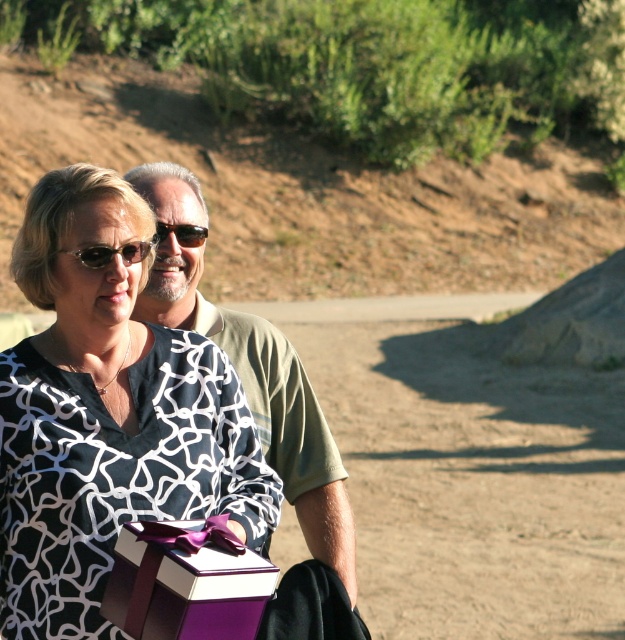
You are a photographer trying to capture a closeup of the green matte shirt at center and the brown matte sunglasses at center. Which object should you zoom in on more to ensure both fit in the frame?

Since the green matte shirt at center is bigger than the brown matte sunglasses at center, you should zoom in more on the brown matte sunglasses at center to ensure both fit in the frame.

You are a photographer trying to capture a clear shot of the green matte shirt at center and the brown matte sunglasses at center. Which object should you focus on first to ensure both are in focus?

The green matte shirt at center is closer to the viewer than the brown matte sunglasses at center. To ensure both are in focus, you should focus on the green matte shirt at center first, as it is closer, and the depth of field will extend to the sunglasses.